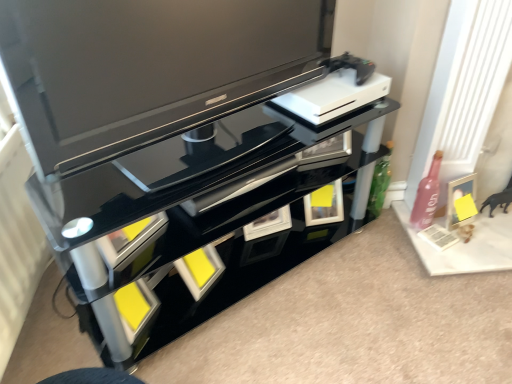
This screenshot has width=512, height=384. What are the coordinates of `space that is in front of pink glass bottle at right` in the screenshot? It's located at (446, 254).